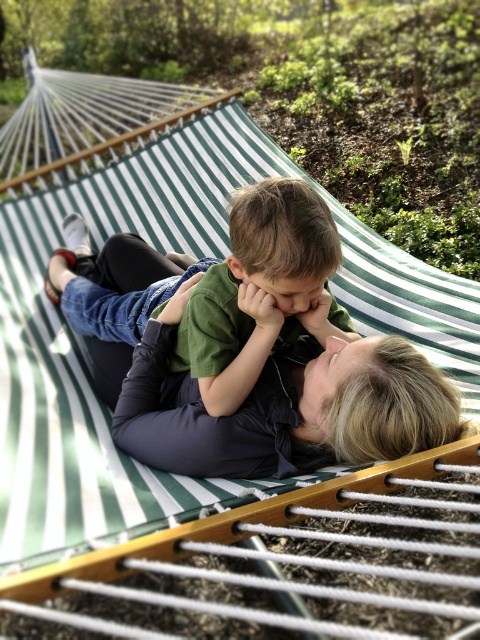
You are a tailor who needs to adjust the length of the matte black pants at center and the green matte shirt at center. Based on their current height, which clothing item requires a shorter adjustment to match the other?

The matte black pants at center has a lesser height compared to the green matte shirt at center, so the pants require a shorter adjustment to match the shirt.

Consider the image. You are a photographer trying to capture a candid shot of the two people in the hammock. You want to ensure that both the matte black pants at center and the green matte shirt at center are clearly visible in the photo. Based on their positions, which object should you focus on first to ensure both are in frame?

The matte black pants at center is positioned on the right side of green matte shirt at center, so focusing on the green matte shirt at center first would ensure both objects are in frame as the pants are to the right of the shirt.